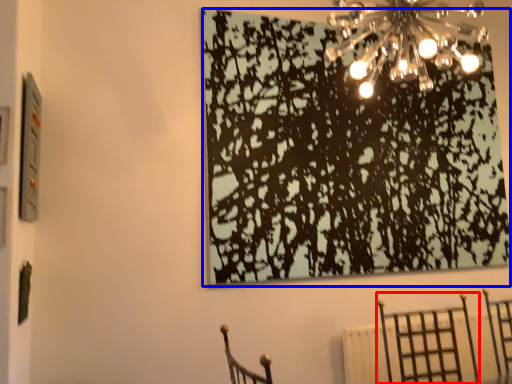
Question: Among these objects, which one is farthest to the camera, furniture (highlighted by a red box) or tree (highlighted by a blue box)?

Choices:
 (A) furniture
 (B) tree

Answer: (B)